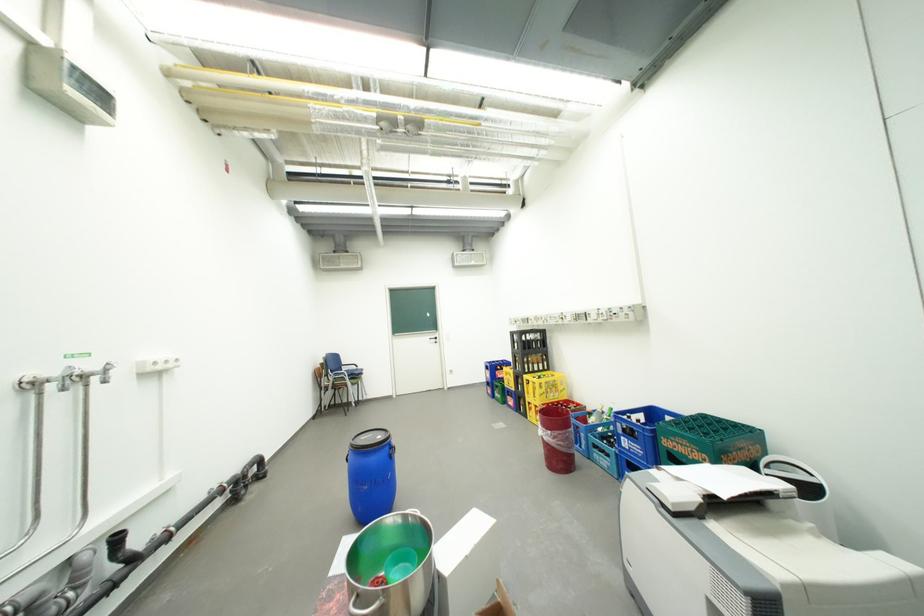
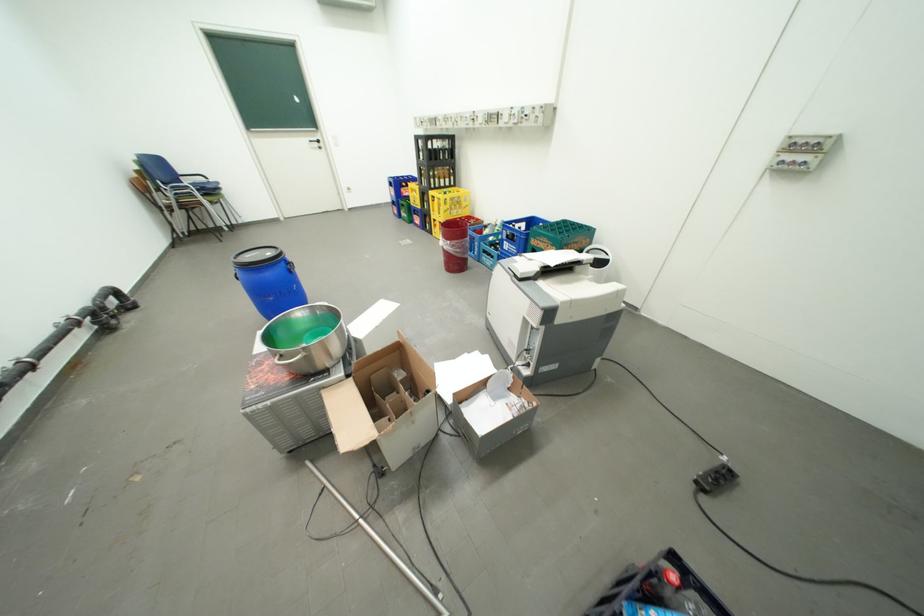
Where in the second image is the point corresponding to point 633,439 from the first image?

(516, 244)